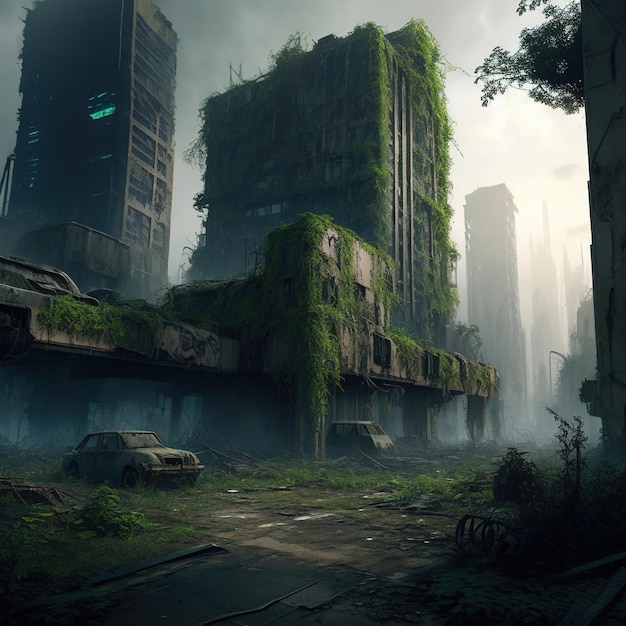
Image resolution: width=626 pixels, height=626 pixels. Identify the location of door. (81, 457), (100, 458).